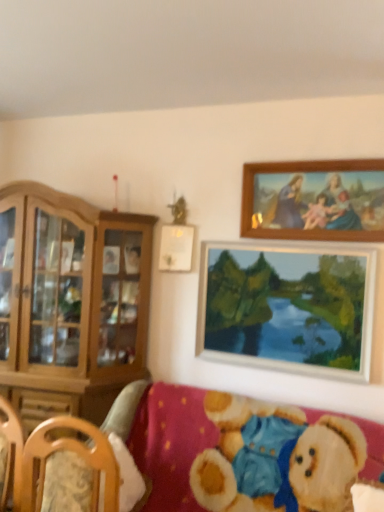
Question: Looking at the image, does velvet teddy bear at lower right seem bigger or smaller compared to wooden picture frame at upper center, the 2th picture frame in the bottom-to-top sequence?

Choices:
 (A) small
 (B) big

Answer: (B)

Question: Is velvet teddy bear at lower right wider or thinner than wooden picture frame at upper center, which ranks as the 2th picture frame in top-to-bottom order?

Choices:
 (A) thin
 (B) wide

Answer: (B)

Question: Which of these objects is positioned farthest from the wooden picture frame at upper center, which ranks as the 2th picture frame in top-to-bottom order?

Choices:
 (A) light brown wood cabinet at left
 (B) wooden picture frame at upper right, the 1th picture frame in the top-to-bottom sequence
 (C) wooden frame painting at upper right, arranged as the third picture frame when viewed from the top
 (D) velvet teddy bear at lower right

Answer: (D)

Question: Which object is positioned closest to the velvet teddy bear at lower right?

Choices:
 (A) wooden picture frame at upper center, the 2th picture frame in the bottom-to-top sequence
 (B) wooden frame painting at upper right, arranged as the third picture frame when viewed from the top
 (C) light brown wood cabinet at left
 (D) wooden picture frame at upper right, the 1th picture frame in the top-to-bottom sequence

Answer: (B)